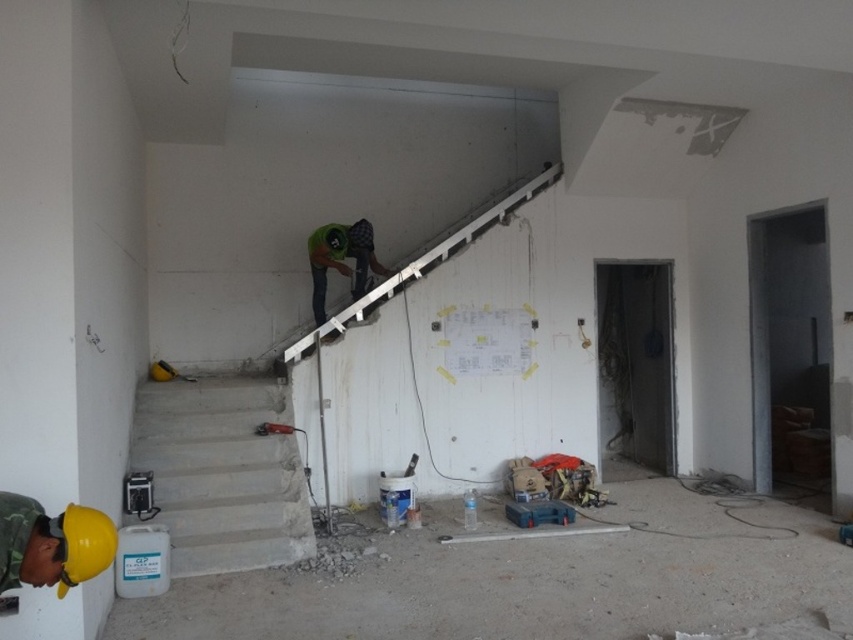
Question: Which point is closer to the camera taking this photo?

Choices:
 (A) (55, 557)
 (B) (321, 236)
 (C) (268, 477)

Answer: (A)

Question: Does concrete stairs at lower left appear on the right side of yellow hard hat at lower left?

Choices:
 (A) no
 (B) yes

Answer: (A)

Question: Which object is farther from the camera taking this photo?

Choices:
 (A) yellow hard hat at lower left
 (B) green fabric construction worker at center

Answer: (B)

Question: In this image, where is yellow hard hat at lower left located relative to green fabric construction worker at center?

Choices:
 (A) above
 (B) below

Answer: (B)

Question: Does concrete stairs at lower left come behind green fabric construction worker at center?

Choices:
 (A) no
 (B) yes

Answer: (A)

Question: Estimate the real-world distances between objects in this image. Which object is closer to the green fabric construction worker at center?

Choices:
 (A) yellow hard hat at lower left
 (B) concrete stairs at lower left

Answer: (B)